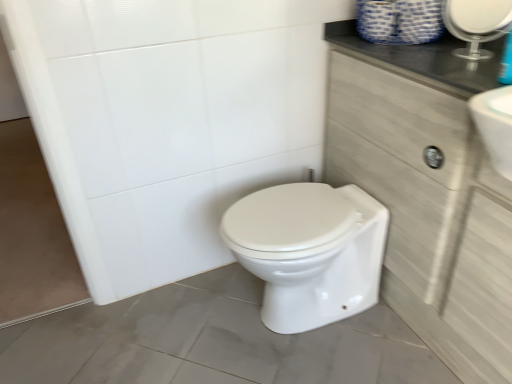
The width and height of the screenshot is (512, 384). Identify the location of vacant space situated on the left part of white glossy bidet at center. (190, 319).